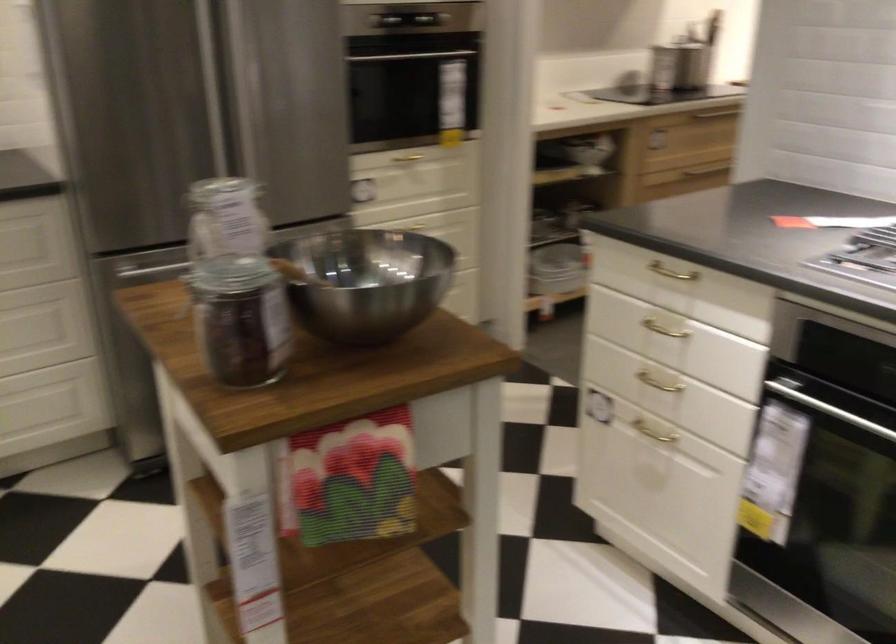
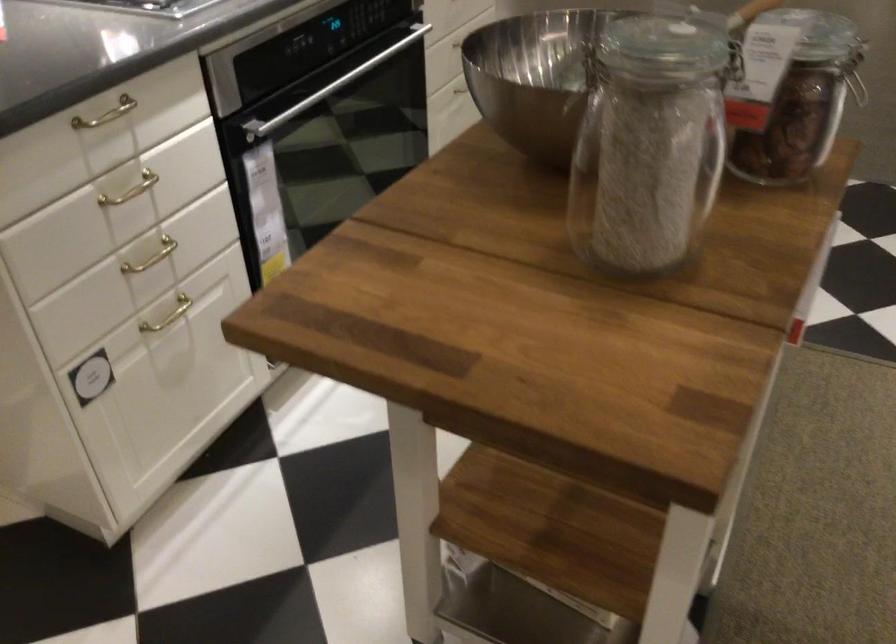
In the second image, find the point that corresponds to the point at 648,319 in the first image.

(131, 190)